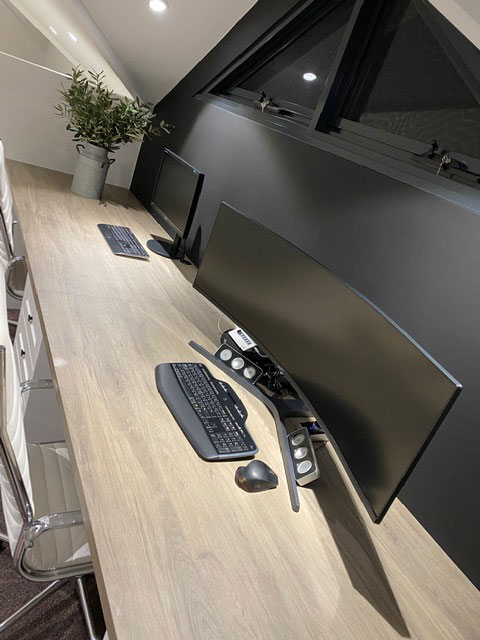
What are the coordinates of `ceiling light reflection` in the screenshot? It's located at (310, 77).